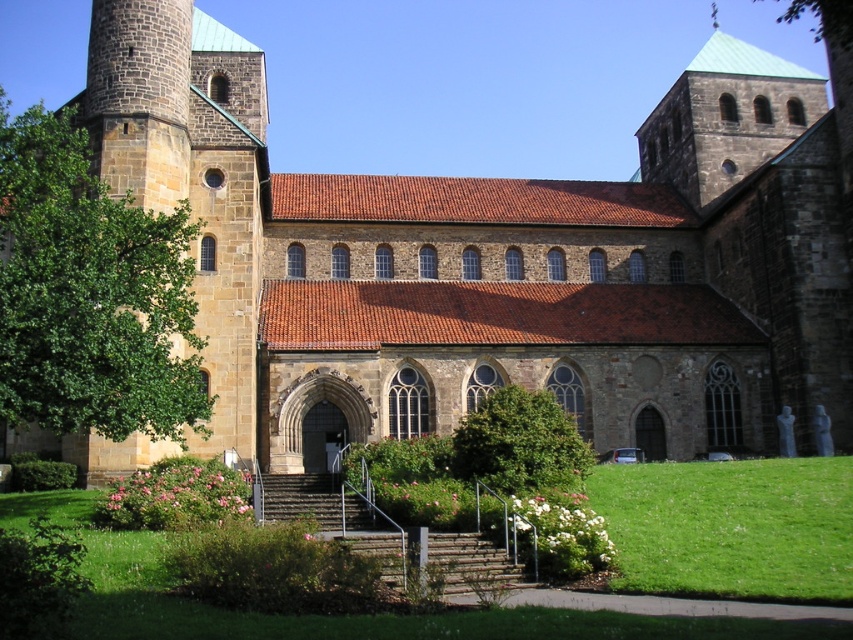
Question: Is green leafy tree at left smaller than green leafy bush at center?

Choices:
 (A) no
 (B) yes

Answer: (A)

Question: Which is nearer to the brown stone stairs at center?

Choices:
 (A) green leafy tree at left
 (B) green leafy bush at center

Answer: (B)

Question: Which of these objects is positioned farthest from the green leafy bush at center?

Choices:
 (A) brown stone stairs at center
 (B) green leafy tree at left

Answer: (B)

Question: Can you confirm if green leafy tree at left is positioned above brown stone stairs at center?

Choices:
 (A) yes
 (B) no

Answer: (A)

Question: Is green leafy tree at left bigger than green leafy bush at center?

Choices:
 (A) yes
 (B) no

Answer: (A)

Question: Estimate the real-world distances between objects in this image. Which object is farther from the brown stone stairs at center?

Choices:
 (A) green leafy bush at center
 (B) green leafy tree at left

Answer: (B)